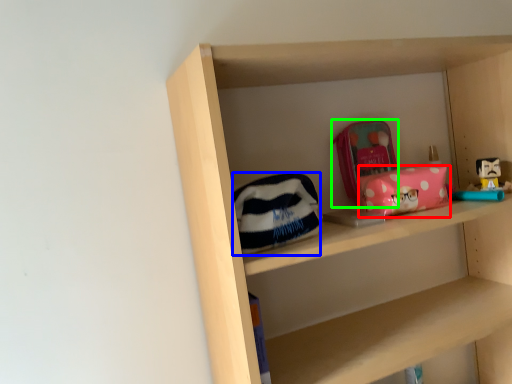
Question: Which is farther away from package (highlighted by a red box)? pouch (highlighted by a blue box) or pouch (highlighted by a green box)?

Choices:
 (A) pouch
 (B) pouch

Answer: (A)